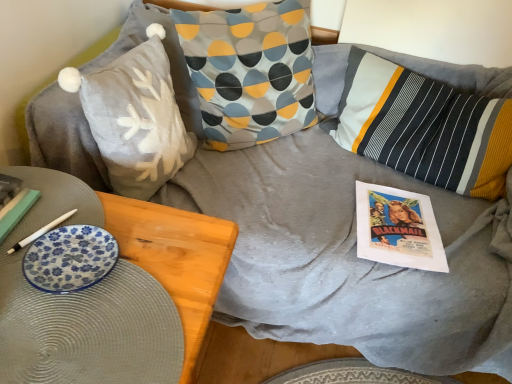
Image resolution: width=512 pixels, height=384 pixels. What do you see at coordinates (17, 213) in the screenshot? I see `matte paper magazine at lower left` at bounding box center [17, 213].

This screenshot has width=512, height=384. In order to click on blue floral plate at lower left in this screenshot , I will do `click(70, 258)`.

Where is `matte paper comic book at center right`? This screenshot has width=512, height=384. matte paper comic book at center right is located at coordinates (398, 228).

What do you see at coordinates (398, 228) in the screenshot? This screenshot has height=384, width=512. I see `matte paper comic book at center right` at bounding box center [398, 228].

You are a GUI agent. You are given a task and a screenshot of the screen. Output one action in this format:
    pyautogui.click(x=<x>, y=<y>)
    Task: Click on the fuzzy gray pillow with white snowflake at upper left, placed as the first pillow when sorted from left to right
    The image size is (512, 384).
    Given the screenshot: What is the action you would take?
    pyautogui.click(x=135, y=117)

From a real-world perspective, is striped cotton pillow at center, the third pillow viewed from the left, physically located above or below matte paper comic book at center right?

striped cotton pillow at center, the third pillow viewed from the left, is above matte paper comic book at center right.

Between striped cotton pillow at center, marked as the 1th pillow in a right-to-left arrangement, and matte paper comic book at center right, which one has smaller width?

matte paper comic book at center right.

Is striped cotton pillow at center, the third pillow viewed from the left, to the left of matte paper comic book at center right from the viewer's perspective?

Incorrect, striped cotton pillow at center, the third pillow viewed from the left, is not on the left side of matte paper comic book at center right.

Is point (444, 157) more distant than point (391, 242)?

Yes, it is.

Locate an element on the screen. The image size is (512, 384). comic book that is under the fuzzy gray pillow with white snowflake at upper left, acting as the 3th pillow starting from the right (from a real-world perspective) is located at coordinates (398, 228).

Which is nearer, (144, 59) or (410, 220)?

Point (144, 59) is positioned closer to the camera compared to point (410, 220).

Considering their positions, is fuzzy gray pillow with white snowflake at upper left, placed as the first pillow when sorted from left to right, located in front of or behind matte paper comic book at center right?

Visually, fuzzy gray pillow with white snowflake at upper left, placed as the first pillow when sorted from left to right, is located in front of matte paper comic book at center right.

From a real-world perspective, who is located higher, fuzzy gray pillow with white snowflake at upper left, acting as the 3th pillow starting from the right, or matte paper comic book at center right?

fuzzy gray pillow with white snowflake at upper left, acting as the 3th pillow starting from the right, from a real-world perspective.

Identify the location of magazine that is behind the blue glazed plate at left. (17, 213).

Considering the sizes of objects blue glazed plate at left and matte paper magazine at lower left in the image provided, who is shorter, blue glazed plate at left or matte paper magazine at lower left?

With less height is matte paper magazine at lower left.

In terms of size, does blue glazed plate at left appear bigger or smaller than matte paper magazine at lower left?

blue glazed plate at left is bigger than matte paper magazine at lower left.

Is the depth of blue glazed plate at left less than that of matte paper magazine at lower left?

That is True.

From the image's perspective, which object appears higher, blue floral plate at lower left or matte paper comic book at center right?

matte paper comic book at center right.

Locate an element on the screen. Image resolution: width=512 pixels, height=384 pixels. plate below the matte paper comic book at center right (from the image's perspective) is located at coordinates (70, 258).

Considering the positions of point (36, 253) and point (394, 201), is point (36, 253) closer or farther from the camera than point (394, 201)?

Point (36, 253) is closer to the camera than point (394, 201).

Is blue floral plate at lower left wider than matte paper comic book at center right?

Incorrect, the width of blue floral plate at lower left does not surpass that of matte paper comic book at center right.

How different are the orientations of striped cotton pillow at center, the third pillow viewed from the left, and blue glazed plate at left in degrees?

The facing directions of striped cotton pillow at center, the third pillow viewed from the left, and blue glazed plate at left are 120 degrees apart.

From the image's perspective, between striped cotton pillow at center, the third pillow viewed from the left, and blue glazed plate at left, which one is located above?

From the image's view, striped cotton pillow at center, the third pillow viewed from the left, is above.

Identify the location of the 1st pillow above the blue glazed plate at left (from a real-world perspective). The width and height of the screenshot is (512, 384). (424, 127).

Considering the relative positions of fuzzy gray pillow with white snowflake at upper left, acting as the 3th pillow starting from the right, and striped cotton pillow at center, the third pillow viewed from the left, in the image provided, is fuzzy gray pillow with white snowflake at upper left, acting as the 3th pillow starting from the right, in front of striped cotton pillow at center, the third pillow viewed from the left,?

Yes, fuzzy gray pillow with white snowflake at upper left, acting as the 3th pillow starting from the right, is closer to the viewer.

Based on their sizes in the image, would you say fuzzy gray pillow with white snowflake at upper left, placed as the first pillow when sorted from left to right, is bigger or smaller than striped cotton pillow at center, the third pillow viewed from the left?

In the image, fuzzy gray pillow with white snowflake at upper left, placed as the first pillow when sorted from left to right, appears to be smaller than striped cotton pillow at center, the third pillow viewed from the left.

From a real-world perspective, is blue glazed plate at left physically above patterned fabric pillow at center, which is counted as the 2th pillow, starting from the right?

Actually, blue glazed plate at left is physically below patterned fabric pillow at center, which is counted as the 2th pillow, starting from the right, in the real world.

From the picture: Is the position of blue glazed plate at left less distant than that of patterned fabric pillow at center, the 2th pillow from the left?

Yes, blue glazed plate at left is in front of patterned fabric pillow at center, the 2th pillow from the left.

From their relative heights in the image, would you say blue glazed plate at left is taller or shorter than patterned fabric pillow at center, which is counted as the 2th pillow, starting from the right?

In the image, blue glazed plate at left appears to be shorter than patterned fabric pillow at center, which is counted as the 2th pillow, starting from the right.

Between blue glazed plate at left and patterned fabric pillow at center, the 2th pillow from the left, which one has smaller size?

patterned fabric pillow at center, the 2th pillow from the left.

Identify the location of comic book that appears behind the striped cotton pillow at center, the third pillow viewed from the left. The image size is (512, 384). (398, 228).

Where is `pillow that is the 2nd object above the matte paper comic book at center right (from a real-world perspective)`? Image resolution: width=512 pixels, height=384 pixels. pillow that is the 2nd object above the matte paper comic book at center right (from a real-world perspective) is located at coordinates (135, 117).

Consider the image. Based on their spatial positions, is blue floral plate at lower left or striped cotton pillow at center, the third pillow viewed from the left, further from matte paper magazine at lower left?

striped cotton pillow at center, the third pillow viewed from the left, is further to matte paper magazine at lower left.

When comparing their distances from matte paper magazine at lower left, does matte paper comic book at center right or fuzzy gray pillow with white snowflake at upper left, acting as the 3th pillow starting from the right, seem closer?

fuzzy gray pillow with white snowflake at upper left, acting as the 3th pillow starting from the right, lies closer to matte paper magazine at lower left than the other object.

When comparing their distances from blue glazed plate at left, does striped cotton pillow at center, the third pillow viewed from the left, or matte paper magazine at lower left seem closer?

matte paper magazine at lower left is closer to blue glazed plate at left.

Based on their spatial positions, is blue floral plate at lower left or matte paper magazine at lower left closer to patterned fabric pillow at center, which is counted as the 2th pillow, starting from the right?

Among the two, matte paper magazine at lower left is located nearer to patterned fabric pillow at center, which is counted as the 2th pillow, starting from the right.

Considering their positions, is blue glazed plate at left positioned further to blue floral plate at lower left than matte paper magazine at lower left?

Among the two, matte paper magazine at lower left is located further to blue floral plate at lower left.

Estimate the real-world distances between objects in this image. Which object is closer to matte paper comic book at center right, blue floral plate at lower left or patterned fabric pillow at center, the 2th pillow from the left?

patterned fabric pillow at center, the 2th pillow from the left, is positioned closer to the anchor matte paper comic book at center right.

Looking at the image, which one is located closer to fuzzy gray pillow with white snowflake at upper left, acting as the 3th pillow starting from the right, matte paper comic book at center right or patterned fabric pillow at center, the 2th pillow from the left?

patterned fabric pillow at center, the 2th pillow from the left, is closer to fuzzy gray pillow with white snowflake at upper left, acting as the 3th pillow starting from the right.

When comparing their distances from fuzzy gray pillow with white snowflake at upper left, acting as the 3th pillow starting from the right, does patterned fabric pillow at center, which is counted as the 2th pillow, starting from the right, or blue floral plate at lower left seem further?

blue floral plate at lower left lies further to fuzzy gray pillow with white snowflake at upper left, acting as the 3th pillow starting from the right, than the other object.

Identify the location of pillow between fuzzy gray pillow with white snowflake at upper left, placed as the first pillow when sorted from left to right, and striped cotton pillow at center, marked as the 1th pillow in a right-to-left arrangement, in the horizontal direction. (250, 71).

At what (x,y) coordinates should I click in order to perform the action: click on furniture between matte paper magazine at lower left and striped cotton pillow at center, marked as the 1th pillow in a right-to-left arrangement, from left to right. Please return your answer as a coordinate pair (x, y). This screenshot has width=512, height=384. Looking at the image, I should click on (112, 291).

Locate an element on the screen. comic book situated between fuzzy gray pillow with white snowflake at upper left, acting as the 3th pillow starting from the right, and striped cotton pillow at center, the third pillow viewed from the left, from left to right is located at coordinates (398, 228).

At what (x,y) coordinates should I click in order to perform the action: click on plate that lies between fuzzy gray pillow with white snowflake at upper left, placed as the first pillow when sorted from left to right, and blue glazed plate at left from top to bottom. Please return your answer as a coordinate pair (x, y). Image resolution: width=512 pixels, height=384 pixels. Looking at the image, I should click on (70, 258).